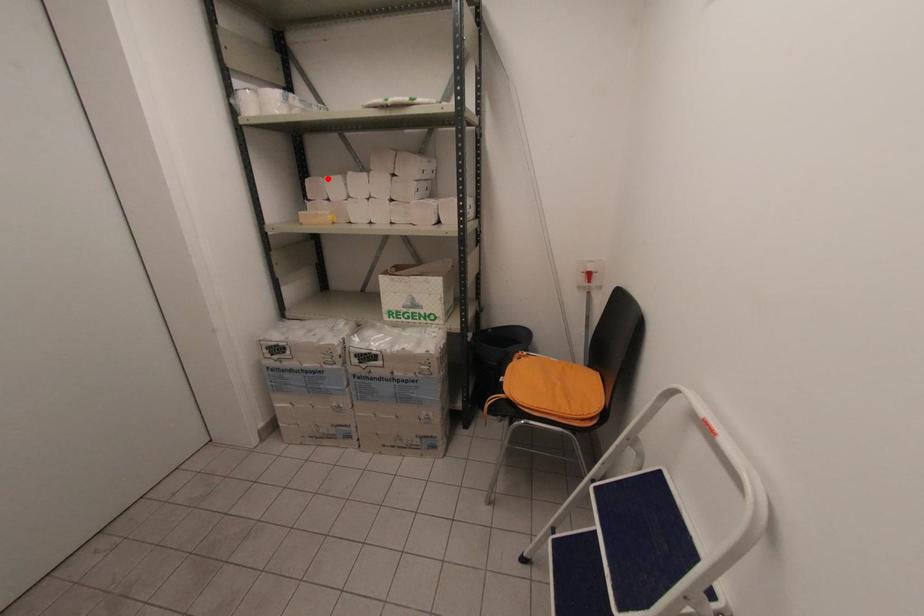
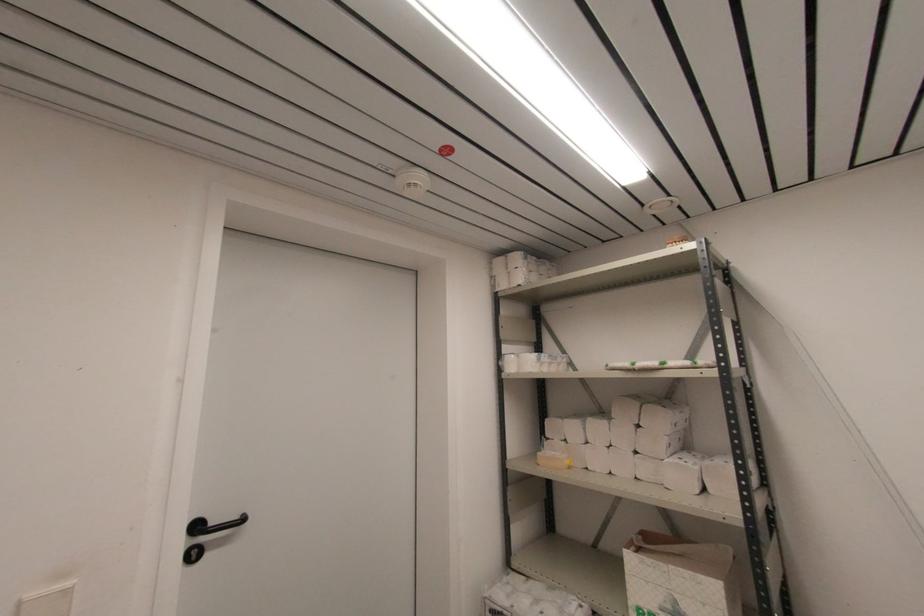
Question: A red point is marked in image1. In image2, is the corresponding 3D point closer to the camera or farther? Reply with the corresponding letter.

Choices:
 (A) The corresponding 3D point is closer.
 (B) The corresponding 3D point is farther.

Answer: (B)